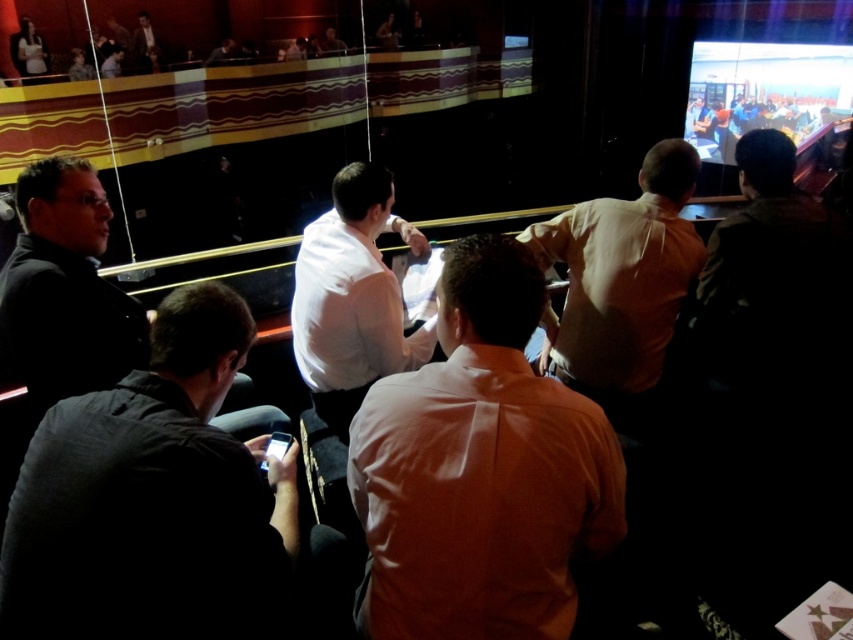
Is orange cotton shirt at center bigger than matte white shirt at upper left?

Incorrect, orange cotton shirt at center is not larger than matte white shirt at upper left.

Which is below, orange cotton shirt at center or matte white shirt at upper left?

orange cotton shirt at center

Measure the distance between orange cotton shirt at center and camera.

orange cotton shirt at center is 1.15 meters away from camera.

Identify the location of orange cotton shirt at center. (480, 470).

Between light brown shirt at center and white smooth shirt at center, which one appears on the right side from the viewer's perspective?

Positioned to the right is light brown shirt at center.

Can you confirm if light brown shirt at center is positioned above white smooth shirt at center?

Indeed, light brown shirt at center is positioned over white smooth shirt at center.

Between point (566, 355) and point (299, 310), which one is positioned behind?

The point (299, 310) is behind.

Identify the location of light brown shirt at center. The width and height of the screenshot is (853, 640). (619, 284).

Consider the image. Does light brown shirt at center have a lesser height compared to matte white shirt at upper left?

Indeed, light brown shirt at center has a lesser height compared to matte white shirt at upper left.

Is light brown shirt at center wider than matte white shirt at upper left?

Indeed, light brown shirt at center has a greater width compared to matte white shirt at upper left.

Which is in front, point (682, 202) or point (38, 44)?

Positioned in front is point (682, 202).

Where is `light brown shirt at center`? light brown shirt at center is located at coordinates (619, 284).